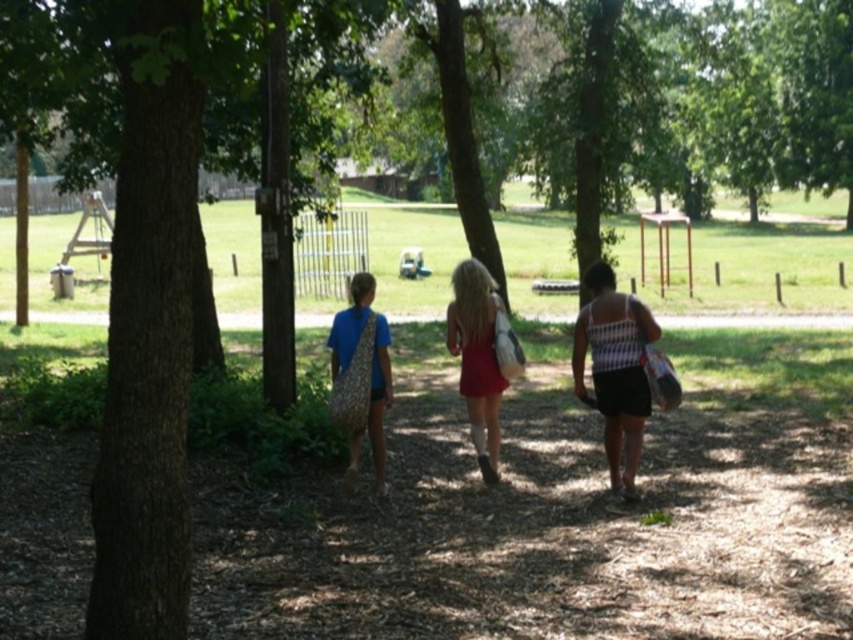
Question: Can you confirm if matte red dress at center is thinner than matte blue shirt at center?

Choices:
 (A) yes
 (B) no

Answer: (A)

Question: Estimate the real-world distances between objects in this image. Which object is closer to the brown dirt path at center?

Choices:
 (A) matte red dress at center
 (B) white textured tank top at center

Answer: (A)

Question: Is the position of matte red dress at center more distant than that of brown dirt path at center?

Choices:
 (A) no
 (B) yes

Answer: (A)

Question: Which point is farther to the camera?

Choices:
 (A) white textured tank top at center
 (B) matte red dress at center
 (C) matte blue shirt at center

Answer: (B)

Question: Is white textured tank top at center below matte blue shirt at center?

Choices:
 (A) no
 (B) yes

Answer: (A)

Question: Which object is closer to the camera taking this photo?

Choices:
 (A) brown dirt path at center
 (B) matte red dress at center
 (C) white textured tank top at center

Answer: (C)